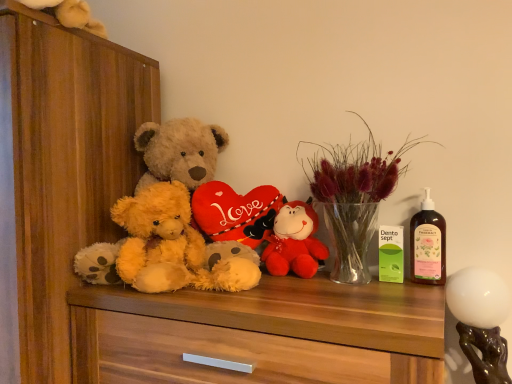
The height and width of the screenshot is (384, 512). What are the coordinates of `white glossy lampshade at right, positioned as the 2th toy in left-to-right order` in the screenshot? It's located at (481, 321).

Locate an element on the screen. This screenshot has height=384, width=512. fluffy yellow teddy bear at center is located at coordinates (158, 239).

Where is `translucent plastic bottle at right`? This screenshot has height=384, width=512. translucent plastic bottle at right is located at coordinates (428, 244).

The height and width of the screenshot is (384, 512). What do you see at coordinates (428, 244) in the screenshot?
I see `translucent plastic bottle at right` at bounding box center [428, 244].

Image resolution: width=512 pixels, height=384 pixels. I want to click on velvet plush bear at center, the 1th toy viewed from the left, so click(295, 242).

Is translucent glass vase at center a part of wooden dresser at left?

Actually, translucent glass vase at center is outside wooden dresser at left.

Between wooden dresser at left and translucent glass vase at center, which one has larger size?

wooden dresser at left.

Can you confirm if wooden dresser at left is positioned to the right of translucent glass vase at center?

No.

Would you say wooden dresser at left is a long distance from translucent glass vase at center?

No, wooden dresser at left is not far from translucent glass vase at center.

From a real-world perspective, is translucent plastic bottle at right located beneath translucent glass vase at center?

Indeed, from a real-world perspective, translucent plastic bottle at right is positioned beneath translucent glass vase at center.

Which is behind, translucent plastic bottle at right or translucent glass vase at center?

Positioned behind is translucent plastic bottle at right.

Is translucent plastic bottle at right taller or shorter than translucent glass vase at center?

Clearly, translucent plastic bottle at right is shorter compared to translucent glass vase at center.

Is translucent plastic bottle at right far from translucent glass vase at center?

No, translucent plastic bottle at right is not far from translucent glass vase at center.

Are wooden dresser at left and translucent plastic bottle at right beside each other?

No, wooden dresser at left is not with translucent plastic bottle at right.

Based on the photo, is wooden dresser at left aimed at translucent plastic bottle at right?

No, wooden dresser at left does not turn towards translucent plastic bottle at right.

Can we say wooden dresser at left lies outside translucent plastic bottle at right?

That's correct, wooden dresser at left is outside of translucent plastic bottle at right.

Considering the sizes of objects wooden dresser at left and translucent plastic bottle at right in the image provided, who is thinner, wooden dresser at left or translucent plastic bottle at right?

translucent plastic bottle at right.

Is white glossy lampshade at right, which is the 2th toy in top-to-bottom order, turned away from translucent plastic bottle at right?

No, translucent plastic bottle at right is not at the back of white glossy lampshade at right, which is the 2th toy in top-to-bottom order.

From a real-world perspective, is white glossy lampshade at right, the 1th toy positioned from the bottom, on top of translucent plastic bottle at right?

No.

From the image's perspective, which one is positioned lower, white glossy lampshade at right, the 1th toy viewed from the right, or translucent plastic bottle at right?

white glossy lampshade at right, the 1th toy viewed from the right, from the image's perspective.

Between point (159, 191) and point (444, 280), which one is positioned behind?

The point (159, 191) is farther from the camera.

Is fluffy yellow teddy bear at center outside of translucent plastic bottle at right?

Yes, fluffy yellow teddy bear at center is outside of translucent plastic bottle at right.

Considering the relative sizes of fluffy yellow teddy bear at center and translucent plastic bottle at right in the image provided, is fluffy yellow teddy bear at center bigger than translucent plastic bottle at right?

Correct, fluffy yellow teddy bear at center is larger in size than translucent plastic bottle at right.

Could you tell me if fluffy yellow teddy bear at center is turned towards translucent plastic bottle at right?

No, fluffy yellow teddy bear at center is not turned towards translucent plastic bottle at right.

Considering the relative positions of white glossy lampshade at right, which is the 2th toy in top-to-bottom order, and velvet plush bear at center, the 2th toy when ordered from bottom to top, in the image provided, is white glossy lampshade at right, which is the 2th toy in top-to-bottom order, to the left of velvet plush bear at center, the 2th toy when ordered from bottom to top, from the viewer's perspective?

No, white glossy lampshade at right, which is the 2th toy in top-to-bottom order, is not to the left of velvet plush bear at center, the 2th toy when ordered from bottom to top.

Is velvet plush bear at center, the 1th toy viewed from the left, inside white glossy lampshade at right, the 1th toy positioned from the bottom?

No, white glossy lampshade at right, the 1th toy positioned from the bottom, does not contain velvet plush bear at center, the 1th toy viewed from the left.

Can you confirm if white glossy lampshade at right, acting as the second toy starting from the back, is thinner than velvet plush bear at center, the first toy in the top-to-bottom sequence?

In fact, white glossy lampshade at right, acting as the second toy starting from the back, might be wider than velvet plush bear at center, the first toy in the top-to-bottom sequence.

Consider the image. From a real-world perspective, is translucent plastic bottle at right positioned over fluffy yellow teddy bear at center based on gravity?

No, from a real-world perspective, translucent plastic bottle at right is not over fluffy yellow teddy bear at center

Does point (425, 216) appear closer or farther from the camera than point (156, 205)?

Point (425, 216).

Is translucent plastic bottle at right next to fluffy yellow teddy bear at center and touching it?

No, translucent plastic bottle at right is not making contact with fluffy yellow teddy bear at center.

Between translucent plastic bottle at right and fluffy yellow teddy bear at center, which one is positioned in front?

fluffy yellow teddy bear at center is more forward.

Locate an element on the screen. Image resolution: width=512 pixels, height=384 pixels. floral arrangement that appears above the wooden dresser at left (from a real-world perspective) is located at coordinates click(x=354, y=196).

Where is `bottle behind the translucent glass vase at center`? Image resolution: width=512 pixels, height=384 pixels. bottle behind the translucent glass vase at center is located at coordinates (428, 244).

In the scene shown: Considering their positions, is wooden dresser at left positioned closer to fluffy yellow teddy bear at center than soft brown plush at center?

soft brown plush at center.

From the image, which object appears to be farther from translucent plastic bottle at right, velvet plush bear at center, the 1th toy viewed from the left, or white glossy lampshade at right, the 1th toy positioned from the bottom?

Based on the image, velvet plush bear at center, the 1th toy viewed from the left, appears to be further to translucent plastic bottle at right.

Consider the image. Looking at the image, which one is located further to fluffy yellow teddy bear at center, soft brown plush at center or translucent glass vase at center?

translucent glass vase at center is further to fluffy yellow teddy bear at center.

Based on their spatial positions, is translucent glass vase at center or soft brown plush at center closer to white glossy lampshade at right, positioned as the 2th toy in left-to-right order?

translucent glass vase at center lies closer to white glossy lampshade at right, positioned as the 2th toy in left-to-right order, than the other object.

Consider the image. When comparing their distances from translucent glass vase at center, does wooden dresser at left or translucent plastic bottle at right seem further?

wooden dresser at left is further to translucent glass vase at center.

Based on their spatial positions, is white glossy lampshade at right, the 1th toy viewed from the front, or velvet plush bear at center, arranged as the second toy when viewed from the right, further from translucent glass vase at center?

Based on the image, white glossy lampshade at right, the 1th toy viewed from the front, appears to be further to translucent glass vase at center.

Looking at the image, which one is located further to translucent glass vase at center, white glossy lampshade at right, acting as the second toy starting from the back, or soft brown plush at center?

Among the two, soft brown plush at center is located further to translucent glass vase at center.

Estimate the real-world distances between objects in this image. Which object is closer to translucent glass vase at center, velvet plush bear at center, the first toy in the top-to-bottom sequence, or wooden dresser at left?

velvet plush bear at center, the first toy in the top-to-bottom sequence, is closer to translucent glass vase at center.

Find the location of a particular element. toy situated between fluffy yellow teddy bear at center and white glossy lampshade at right, the 1th toy viewed from the right, from left to right is located at coordinates (295, 242).

Find the location of a particular element. teddy bear between fluffy yellow teddy bear at center and translucent glass vase at center is located at coordinates (170, 220).

Locate an element on the screen. bottle between fluffy yellow teddy bear at center and white glossy lampshade at right, which is the 2th toy in top-to-bottom order, from left to right is located at coordinates (428, 244).

You are a GUI agent. You are given a task and a screenshot of the screen. Output one action in this format:
    pyautogui.click(x=<x>, y=<y>)
    Task: Click on the teddy bear between wooden dresser at left and translucent plastic bottle at right in the horizontal direction
    The image size is (512, 384).
    Given the screenshot: What is the action you would take?
    pyautogui.click(x=170, y=220)